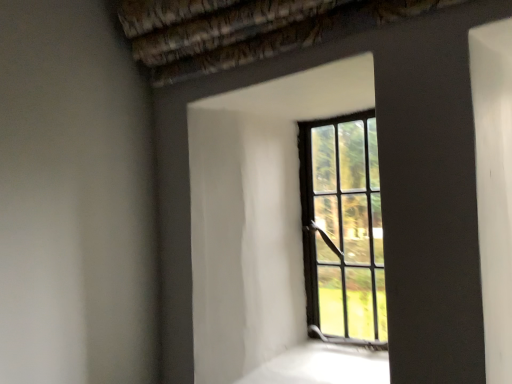
The width and height of the screenshot is (512, 384). What do you see at coordinates (343, 229) in the screenshot?
I see `matte black window at center` at bounding box center [343, 229].

Locate an element on the screen. The image size is (512, 384). matte black window at center is located at coordinates [x=343, y=229].

Locate an element on the screen. The width and height of the screenshot is (512, 384). matte black window at center is located at coordinates (343, 229).